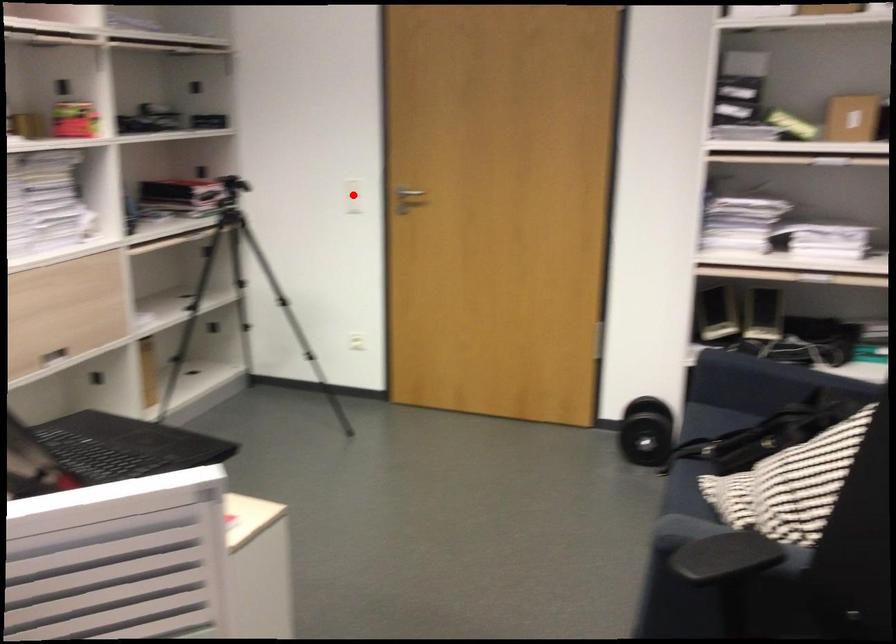
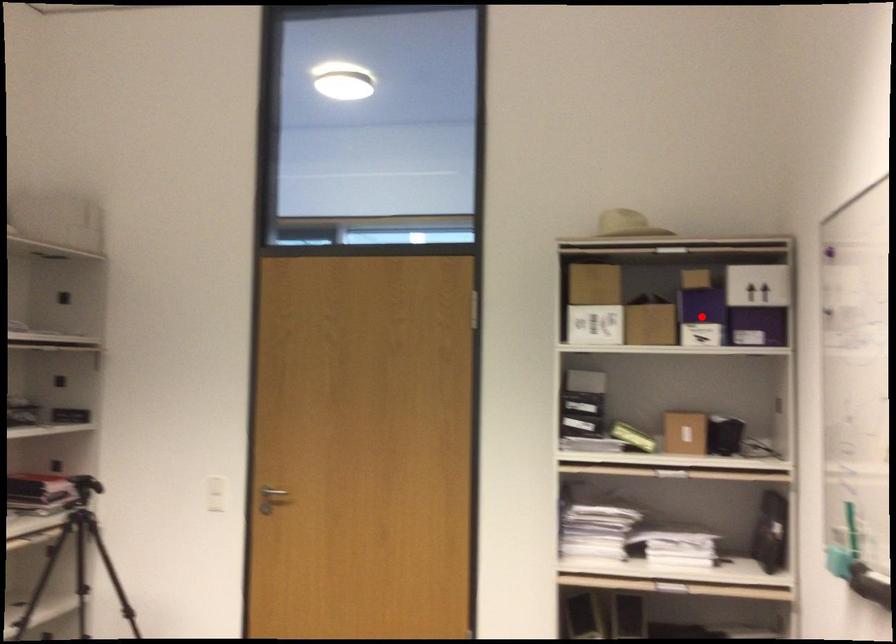
I am providing you with two images of the same scene from different viewpoints. A red point is marked on the first image and another point is marked on the second image. Does the point marked in image1 correspond to the same location as the one in image2?

No